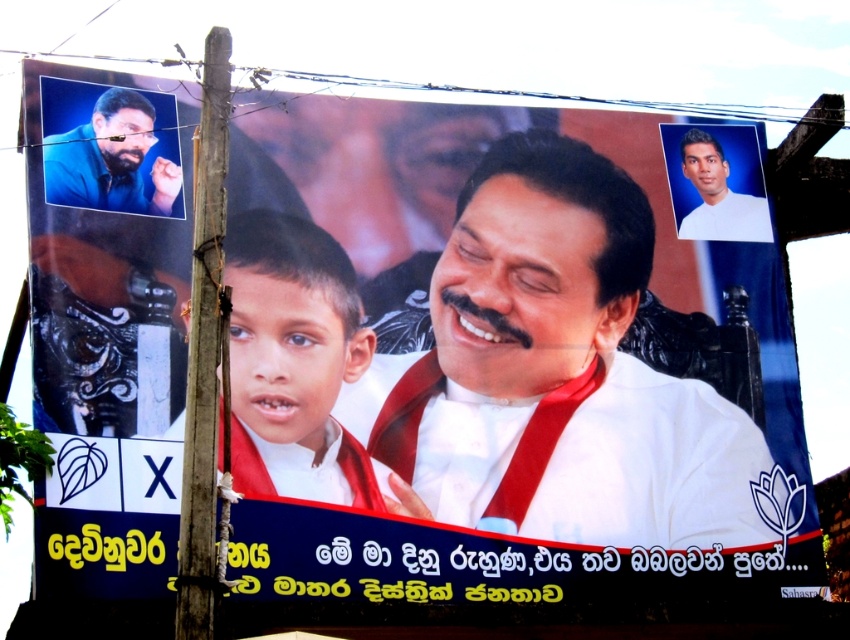
Between white glossy shirt at center and white glossy boy at center, which one is positioned higher?

Positioned higher is white glossy boy at center.

Who is shorter, white glossy shirt at center or white glossy boy at center?

With less height is white glossy boy at center.

Between point (625, 433) and point (238, 326), which one is positioned behind?

Point (625, 433)

Locate an element on the screen. The image size is (850, 640). white glossy shirt at center is located at coordinates (561, 378).

Between white glossy boy at center and matte blue shirt at upper left, which one appears on the left side from the viewer's perspective?

Positioned to the left is matte blue shirt at upper left.

Is point (250, 406) positioned before point (63, 156)?

Yes, point (250, 406) is in front of point (63, 156).

I want to click on white glossy boy at center, so click(x=295, y=362).

Is white glossy shirt at center closer to camera compared to matte blue shirt at upper left?

No.

Between point (670, 490) and point (97, 150), which one is positioned behind?

The point (670, 490) is behind.

Between point (374, 394) and point (75, 96), which one is positioned in front?

Point (374, 394) is in front.

Locate an element on the screen. white glossy shirt at center is located at coordinates (561, 378).